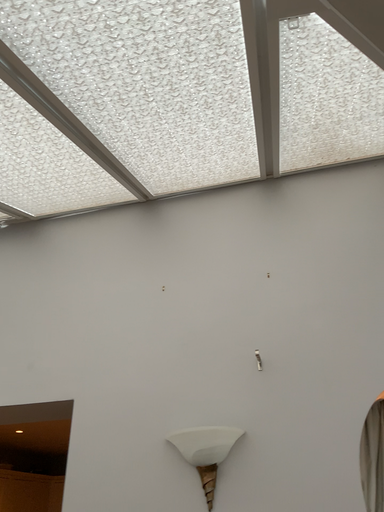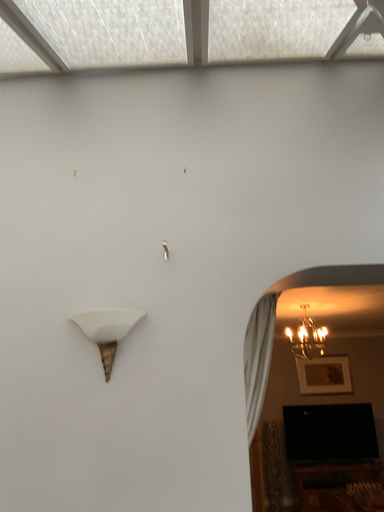
Question: How did the camera likely rotate when shooting the video?

Choices:
 (A) rotated downward
 (B) rotated upward

Answer: (A)